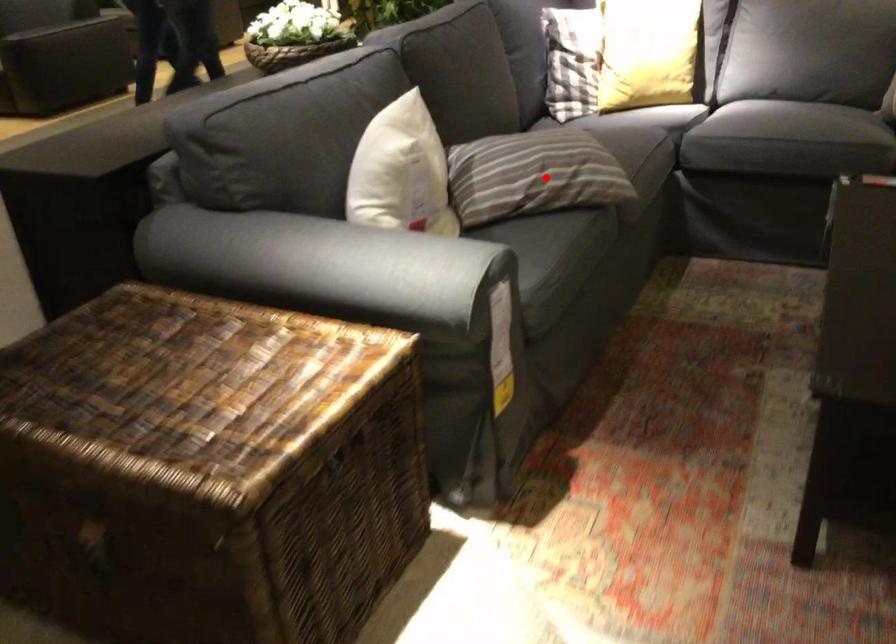
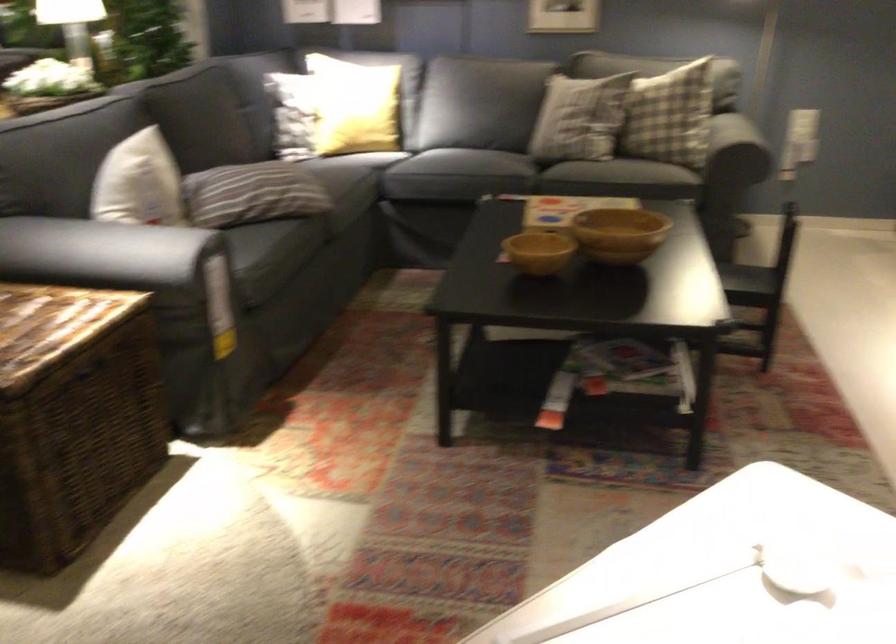
Question: I am providing you with two images of the same scene from different viewpoints. A red point is marked on the first image. Is the red point's position out of view in image 2?

Choices:
 (A) Yes
 (B) No

Answer: (B)